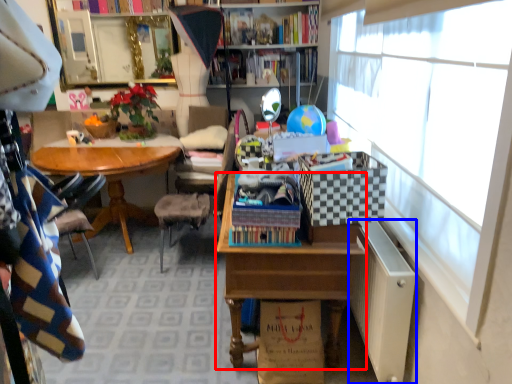
Question: Which object appears closest to the camera in this image, desk (highlighted by a red box) or file cabinet (highlighted by a blue box)?

Choices:
 (A) desk
 (B) file cabinet

Answer: (B)